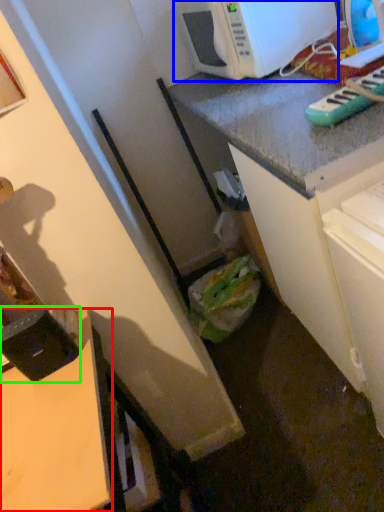
Question: Estimate the real-world distances between objects in this image. Which object is closer to desk (highlighted by a red box), microwave oven (highlighted by a blue box) or appliance (highlighted by a green box)?

Choices:
 (A) microwave oven
 (B) appliance

Answer: (B)